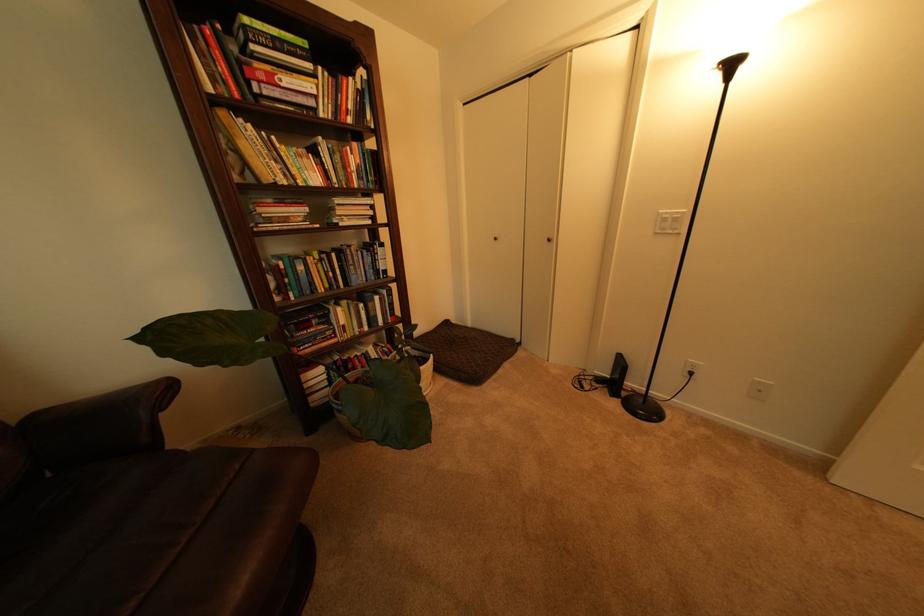
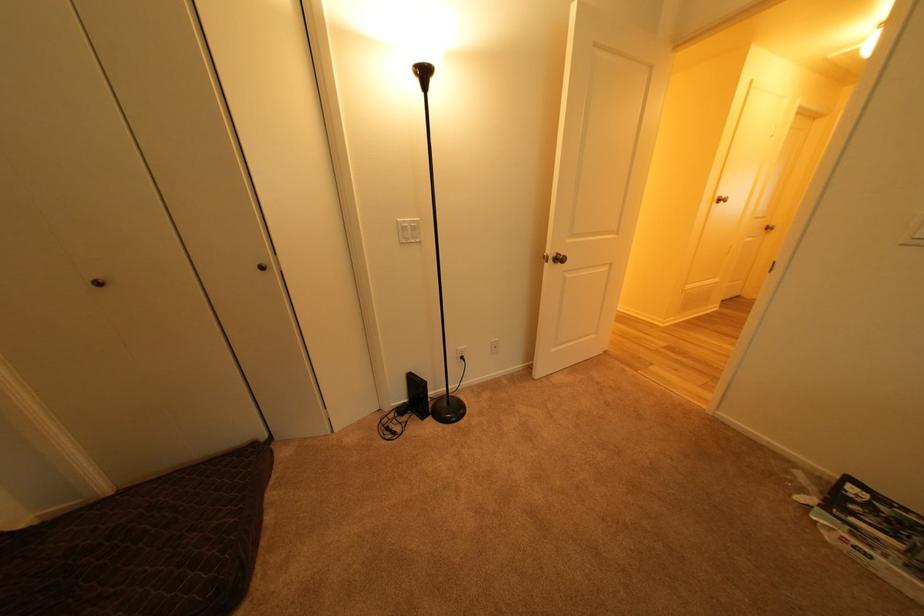
Where in the second image is the point corresponding to pixel 618 378 from the first image?

(417, 402)